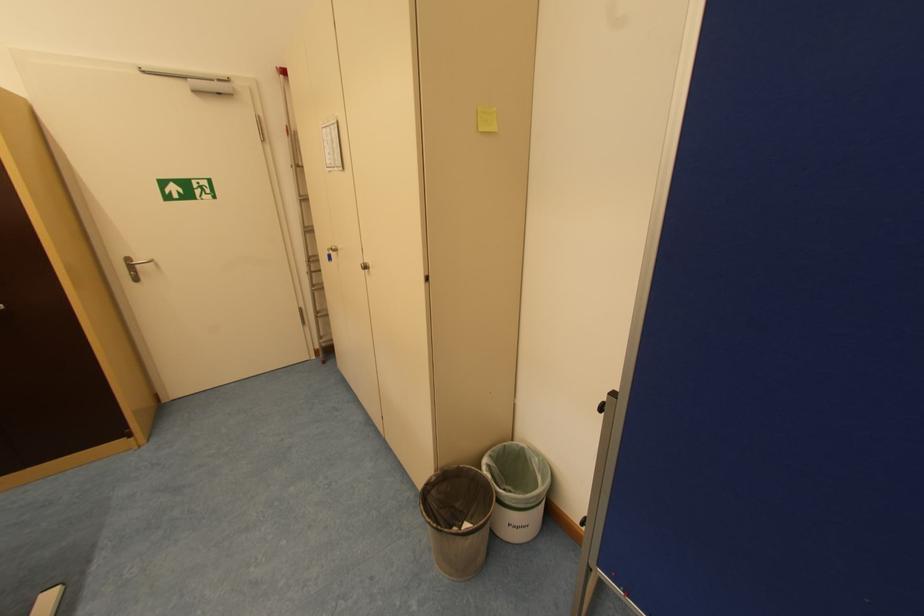
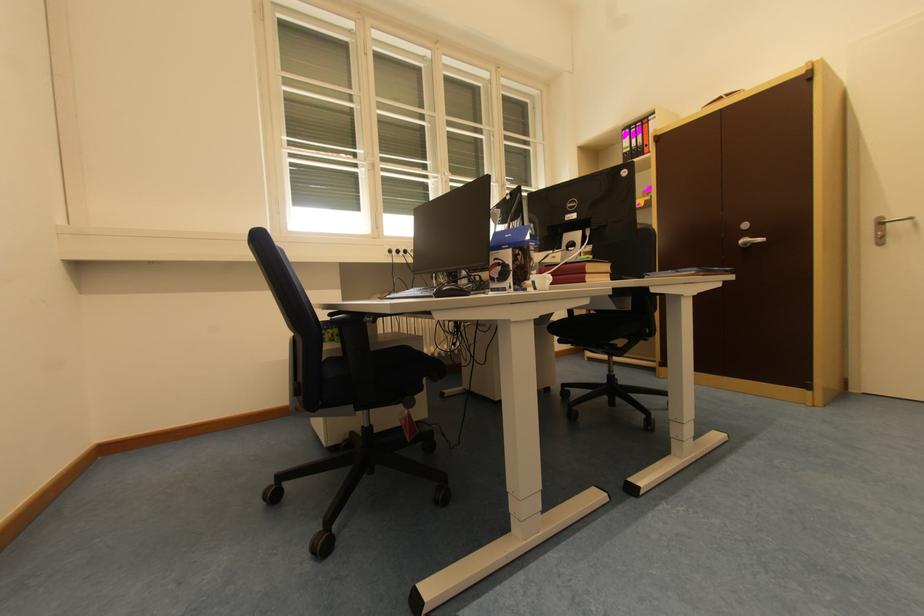
In the second image, find the point that corresponds to [135,261] in the first image.

(888, 220)